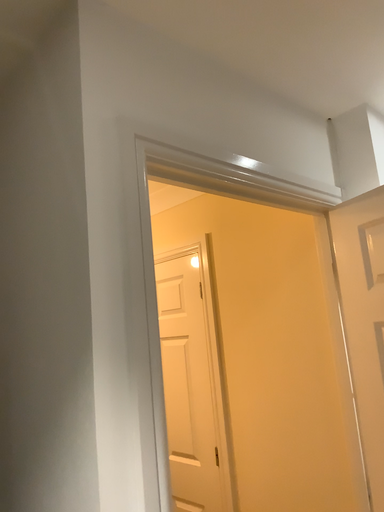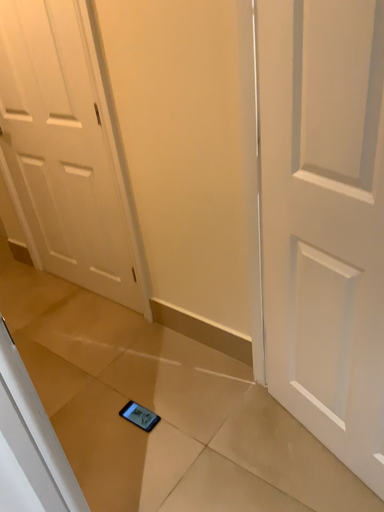
Question: Which way did the camera rotate in the video?

Choices:
 (A) rotated upward
 (B) rotated downward

Answer: (B)